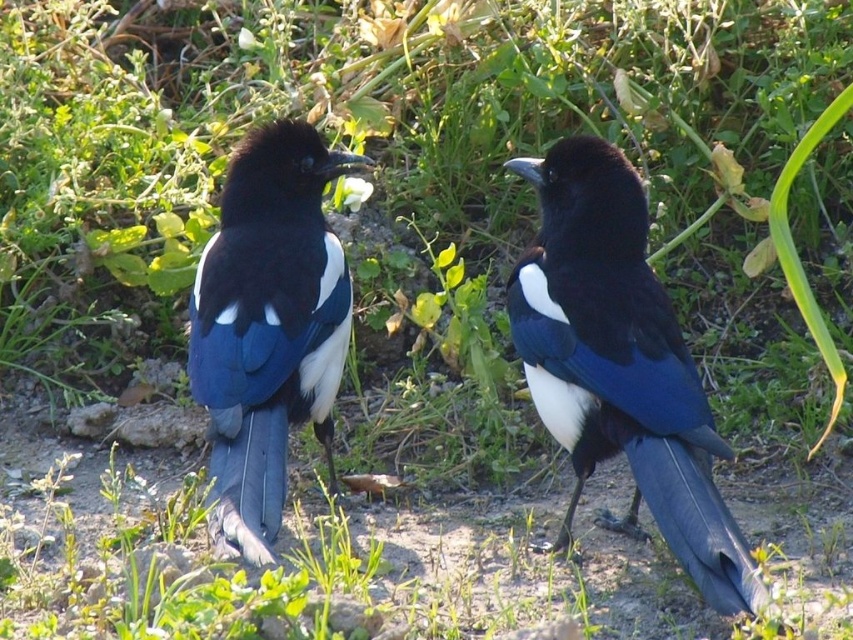
Is green leafy grass at center smaller than shiny blue magpie at center?

Actually, green leafy grass at center might be larger than shiny blue magpie at center.

Does green leafy grass at center appear on the left side of shiny blue magpie at center?

No, green leafy grass at center is not to the left of shiny blue magpie at center.

Describe the element at coordinates (376, 570) in the screenshot. I see `green leafy grass at center` at that location.

Identify the location of green leafy grass at center. (376, 570).

Does shiny black magpie at center appear over shiny blue magpie at center?

No.

What do you see at coordinates (619, 364) in the screenshot? The image size is (853, 640). I see `shiny black magpie at center` at bounding box center [619, 364].

Is point (637, 364) positioned in front of point (256, 406)?

Yes, point (637, 364) is in front of point (256, 406).

Identify the location of shiny black magpie at center. (619, 364).

Can you confirm if green leafy grass at center is wider than shiny black magpie at center?

Indeed, green leafy grass at center has a greater width compared to shiny black magpie at center.

From the picture: Who is shorter, green leafy grass at center or shiny black magpie at center?

green leafy grass at center is shorter.

At what (x,y) coordinates should I click in order to perform the action: click on green leafy grass at center. Please return your answer as a coordinate pair (x, y). The height and width of the screenshot is (640, 853). Looking at the image, I should click on (376, 570).